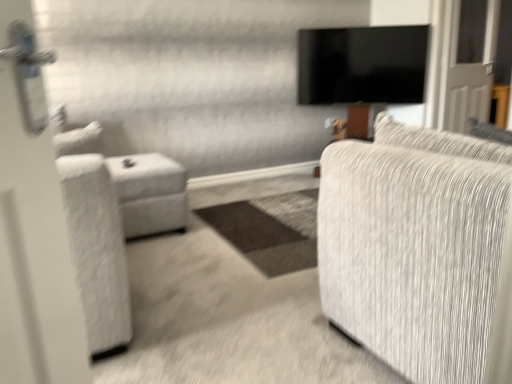
Question: From the image's perspective, is black glossy tv at upper center over white fabric ottoman at left?

Choices:
 (A) yes
 (B) no

Answer: (A)

Question: Is black glossy tv at upper center not close to white fabric ottoman at left?

Choices:
 (A) yes
 (B) no

Answer: (A)

Question: Can you see black glossy tv at upper center touching white fabric ottoman at left?

Choices:
 (A) no
 (B) yes

Answer: (A)

Question: Is black glossy tv at upper center bigger than white fabric ottoman at left?

Choices:
 (A) yes
 (B) no

Answer: (B)

Question: Is black glossy tv at upper center wider than white fabric ottoman at left?

Choices:
 (A) yes
 (B) no

Answer: (B)

Question: From the image's perspective, is white fabric ottoman at left positioned above or below black glossy tv at upper center?

Choices:
 (A) above
 (B) below

Answer: (B)

Question: Looking at the image, does white fabric ottoman at left seem bigger or smaller compared to black glossy tv at upper center?

Choices:
 (A) small
 (B) big

Answer: (B)

Question: Visually, is white fabric ottoman at left positioned to the left or to the right of black glossy tv at upper center?

Choices:
 (A) right
 (B) left

Answer: (B)

Question: Is white fabric ottoman at left taller or shorter than black glossy tv at upper center?

Choices:
 (A) tall
 (B) short

Answer: (B)

Question: In the image, is black glossy tv at upper center on the left side or the right side of white fabric ottoman at left?

Choices:
 (A) right
 (B) left

Answer: (A)

Question: Is black glossy tv at upper center bigger or smaller than white fabric ottoman at left?

Choices:
 (A) small
 (B) big

Answer: (A)

Question: Is black glossy tv at upper center situated inside white fabric ottoman at left or outside?

Choices:
 (A) inside
 (B) outside

Answer: (B)

Question: From a real-world perspective, is black glossy tv at upper center positioned above or below white fabric ottoman at left?

Choices:
 (A) below
 (B) above

Answer: (B)

Question: Based on their sizes in the image, would you say textured gray fabric couch at right is bigger or smaller than white fabric ottoman at left?

Choices:
 (A) big
 (B) small

Answer: (A)

Question: Relative to white fabric ottoman at left, is textured gray fabric couch at right in front or behind?

Choices:
 (A) behind
 (B) front

Answer: (B)